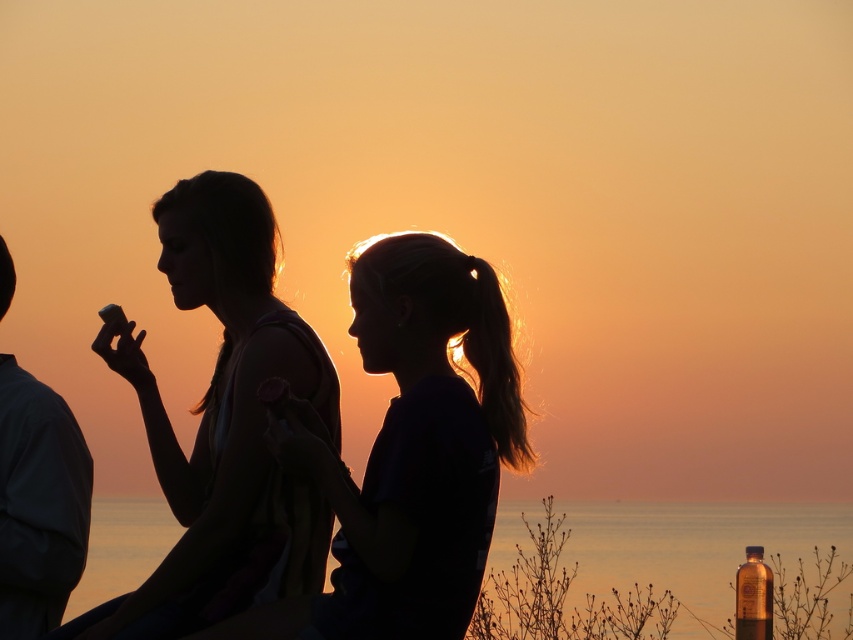
You are a photographer trying to capture the sunset scene. You want to ensure that the silhouette hair at center and the translucent amber bottle at lower right are both visible in your shot. Given their sizes, which object will require more horizontal space in the frame?

The silhouette hair at center requires more horizontal space in the frame because its width surpasses that of the translucent amber bottle at lower right.

You are a photographer trying to capture the sunset scene. You notice the silhouette hair at center and the translucent amber bottle at lower right. Which object should you focus on first if you want to ensure both are in sharp focus without moving the camera?

You should focus on the silhouette hair at center first because it is closer to the camera than the translucent amber bottle at lower right, so focusing on the closer object will keep both in focus when using a narrow depth of field.

You are a photographer trying to capture the sunset scene. You notice the silhouette hair at center and the smooth fabric shirt at left. Which object would appear taller in your photo?

The silhouette hair at center appears taller than the smooth fabric shirt at left in the photo.